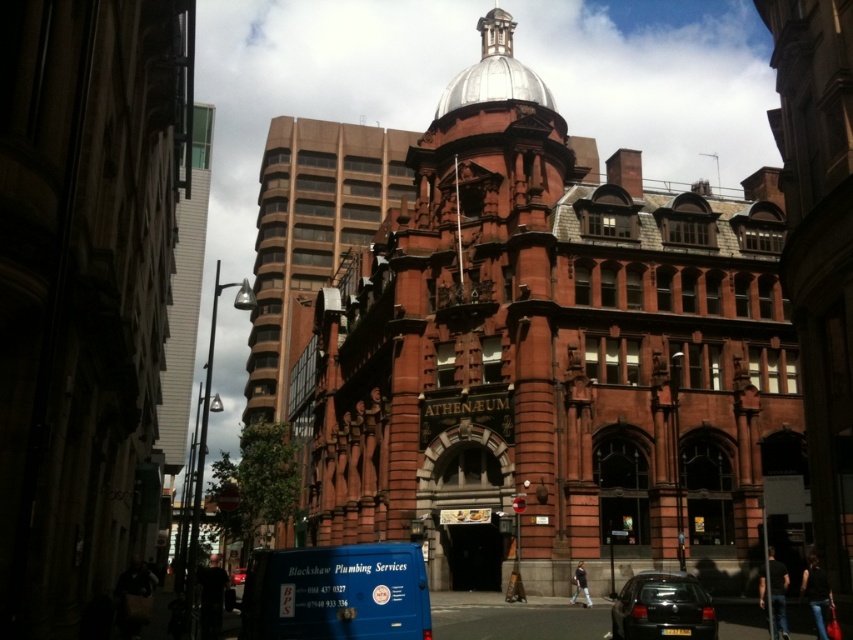
Question: Which point is closer to the camera?

Choices:
 (A) (656, 628)
 (B) (175, 339)

Answer: (A)

Question: Is white glass tower at upper left thinner than shiny black car at lower right?

Choices:
 (A) no
 (B) yes

Answer: (A)

Question: Is the position of shiny black car at lower right more distant than that of metallic blue van at lower center?

Choices:
 (A) no
 (B) yes

Answer: (A)

Question: Which object is farther from the camera taking this photo?

Choices:
 (A) shiny silver dome at center top
 (B) white glass tower at upper left
 (C) shiny black car at lower right
 (D) metallic blue van at lower center

Answer: (D)

Question: Is shiny black car at lower right bigger than shiny silver dome at center top?

Choices:
 (A) yes
 (B) no

Answer: (B)

Question: Which of the following is the farthest from the observer?

Choices:
 (A) metallic blue van at lower center
 (B) white glass tower at upper left
 (C) shiny silver dome at center top
 (D) shiny black car at lower right

Answer: (A)